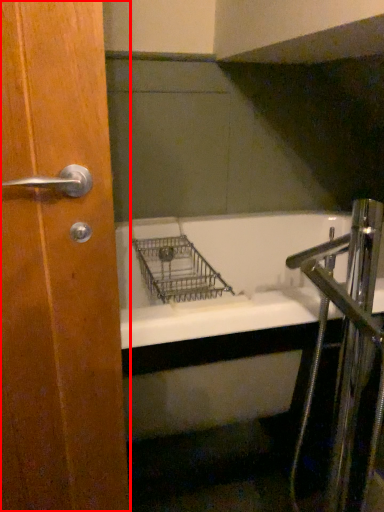
Question: Considering the relative positions of door (annotated by the red box) and faucet in the image provided, where is door (annotated by the red box) located with respect to the staircase?

Choices:
 (A) left
 (B) right

Answer: (A)